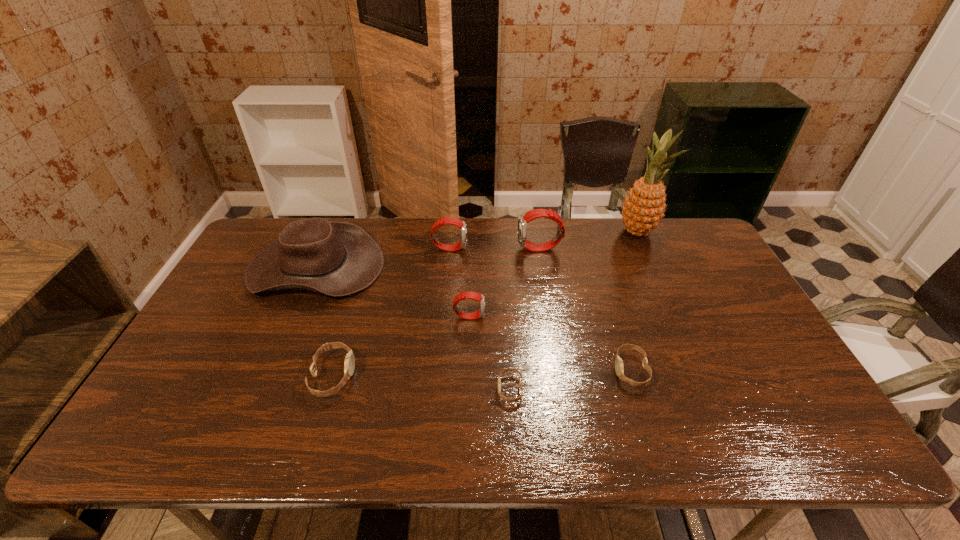
Where is `the leftmost beige watch`? This screenshot has width=960, height=540. the leftmost beige watch is located at coordinates (349, 364).

What are the coordinates of `the second smallest beige watch` in the screenshot? It's located at (619, 367).

I want to click on the second shortest watch, so click(x=619, y=367).

In order to click on the shortest object in this screenshot , I will do `click(517, 399)`.

At what (x,y) coordinates should I click in order to perform the action: click on the smallest beige watch. Please return your answer as a coordinate pair (x, y). Image resolution: width=960 pixels, height=540 pixels. Looking at the image, I should click on (517, 399).

Image resolution: width=960 pixels, height=540 pixels. I want to click on vacant region located on the front of the rightmost object, so click(679, 325).

Where is `blank space located on the face of the tallest watch`? blank space located on the face of the tallest watch is located at coordinates (503, 249).

Where is `free space located on the face of the tallest watch`? The height and width of the screenshot is (540, 960). free space located on the face of the tallest watch is located at coordinates (441, 249).

Image resolution: width=960 pixels, height=540 pixels. I want to click on vacant space situated on the face of the tallest watch, so click(x=473, y=249).

This screenshot has height=540, width=960. In order to click on free point located on the right of the cowboy hat in this screenshot , I will do `click(482, 267)`.